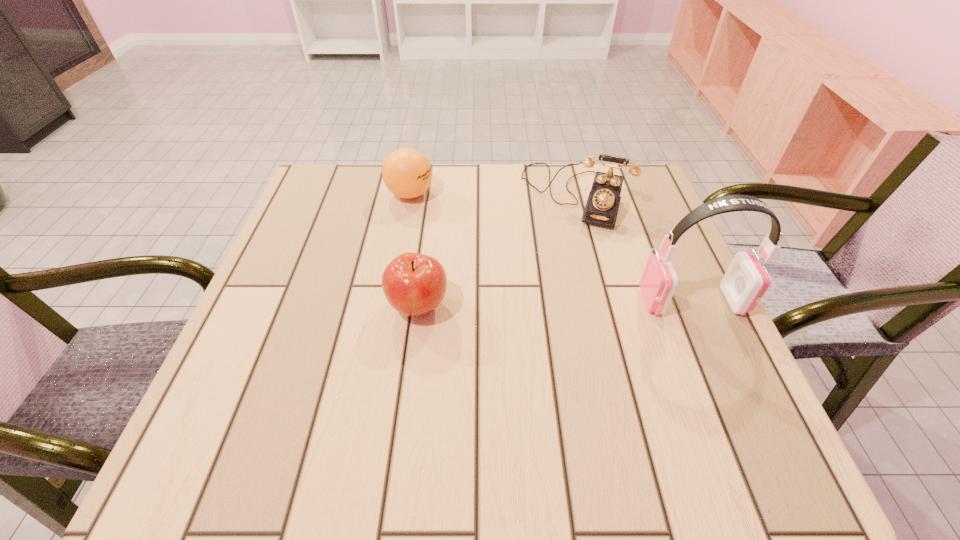
The height and width of the screenshot is (540, 960). Find the location of `free spot on the desktop that is between the apple and the earphone and is positioned on the side with brand of the ping-pong ball`. free spot on the desktop that is between the apple and the earphone and is positioned on the side with brand of the ping-pong ball is located at coordinates (568, 303).

Locate an element on the screen. vacant spot on the desktop that is between the apple and the tallest object and is positioned on the dial of the telephone is located at coordinates (537, 304).